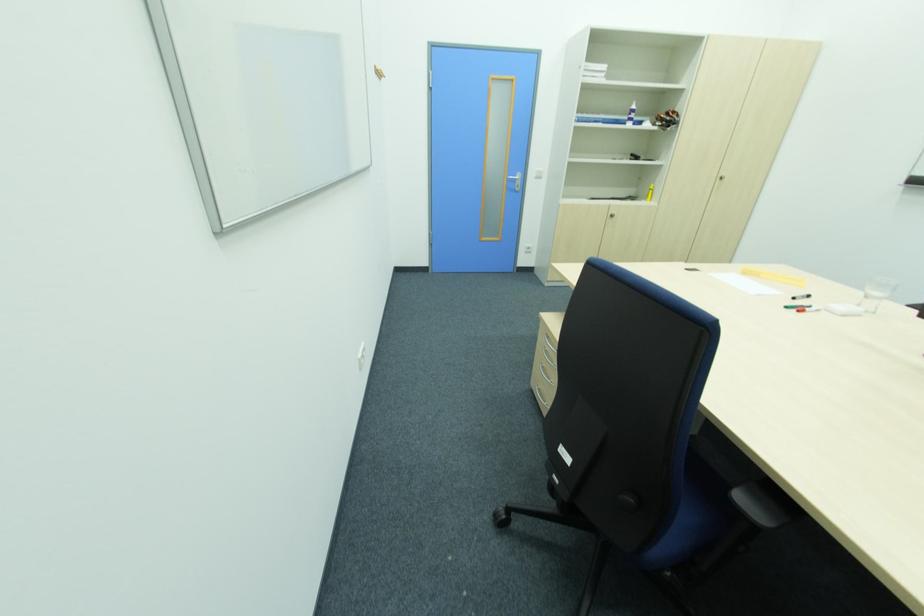
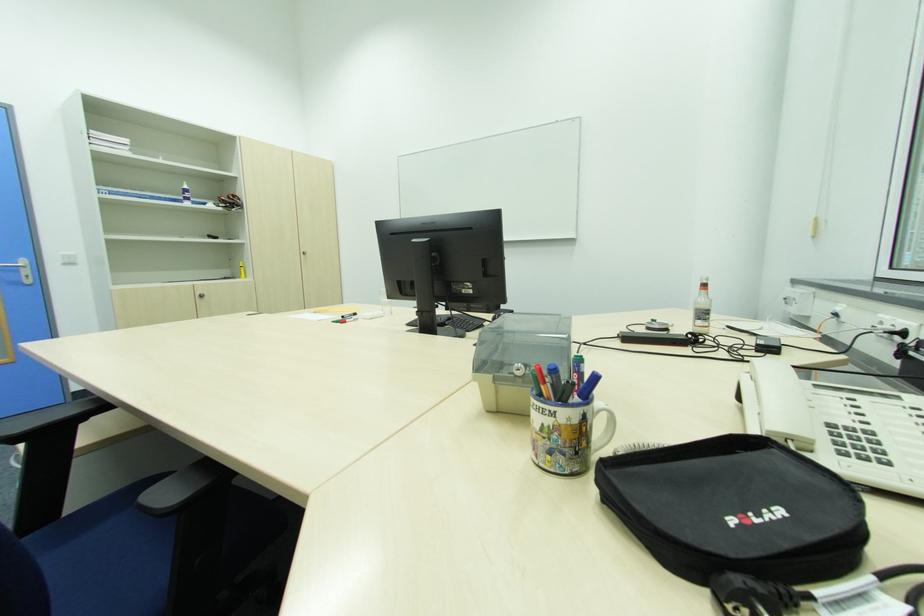
The point at (x=540, y=169) is marked in the first image. Where is the corresponding point in the second image?

(64, 254)